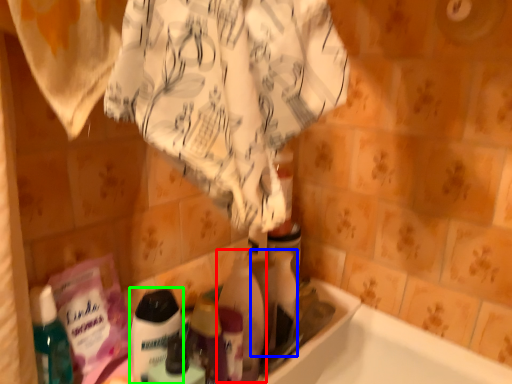
Question: Which object is the closest to the cleaning product (highlighted by a red box)? Choose among these: cleaning product (highlighted by a blue box) or cleaning product (highlighted by a green box).

Choices:
 (A) cleaning product
 (B) cleaning product

Answer: (A)